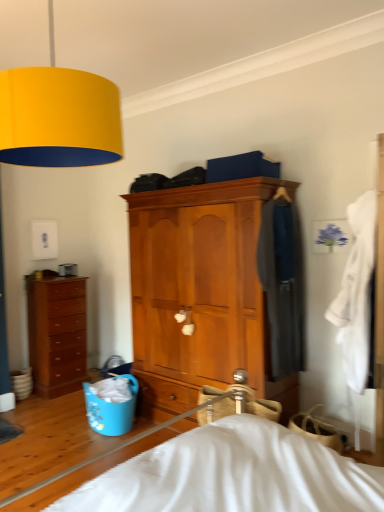
Question: Do you think wooden cabinet at center, positioned as the first chest of drawers in front-to-back order, is within brown wooden chest of drawers at left, which appears as the first chest of drawers when viewed from the back, or outside of it?

Choices:
 (A) inside
 (B) outside

Answer: (B)

Question: Looking at their shapes, would you say wooden cabinet at center, the 2th chest of drawers from the back, is wider or thinner than brown wooden chest of drawers at left, the 2th chest of drawers positioned from the right?

Choices:
 (A) thin
 (B) wide

Answer: (B)

Question: Estimate the real-world distances between objects in this image. Which object is farther from the white cotton robe at right, acting as the 2th clothing starting from the back?

Choices:
 (A) blue plastic laundry basket at lower left
 (B) wooden cabinet at center, which ranks as the 2th chest of drawers in left-to-right order
 (C) brown wooden chest of drawers at left, the 2th chest of drawers positioned from the right
 (D) yellow matte lampshade at upper left
 (E) dark gray fabric coat at center right, which ranks as the first clothing in back-to-front order

Answer: (C)

Question: Estimate the real-world distances between objects in this image. Which object is farther from the brown wooden chest of drawers at left, which is counted as the 1th chest of drawers, starting from the left?

Choices:
 (A) wooden cabinet at center, positioned as the first chest of drawers in front-to-back order
 (B) white cotton robe at right, which ranks as the 1th clothing in front-to-back order
 (C) blue plastic laundry basket at lower left
 (D) yellow matte lampshade at upper left
 (E) dark gray fabric coat at center right, the second clothing in the front-to-back sequence

Answer: (B)